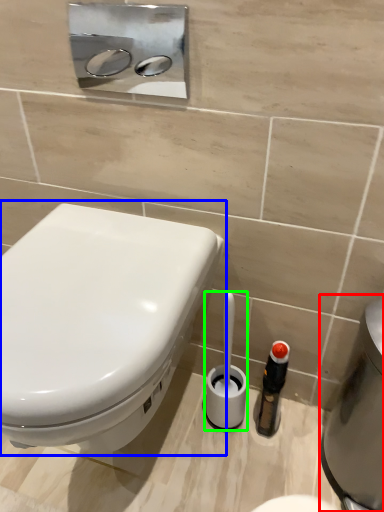
Question: Estimate the real-world distances between objects in this image. Which object is farther from water heater (highlighted by a red box), toilet (highlighted by a blue box) or brush (highlighted by a green box)?

Choices:
 (A) toilet
 (B) brush

Answer: (A)